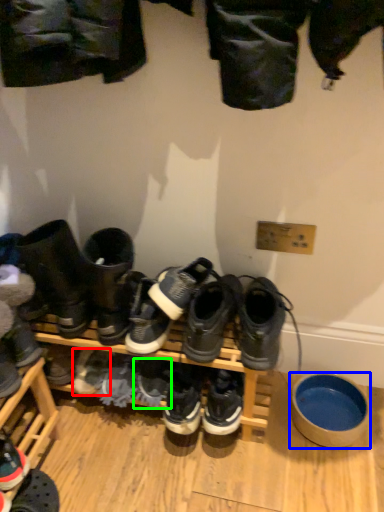
Question: Based on their relative distances, which object is nearer to footwear (highlighted by a red box)? Choose from bowl (highlighted by a blue box) and shoe (highlighted by a green box).

Choices:
 (A) bowl
 (B) shoe

Answer: (B)